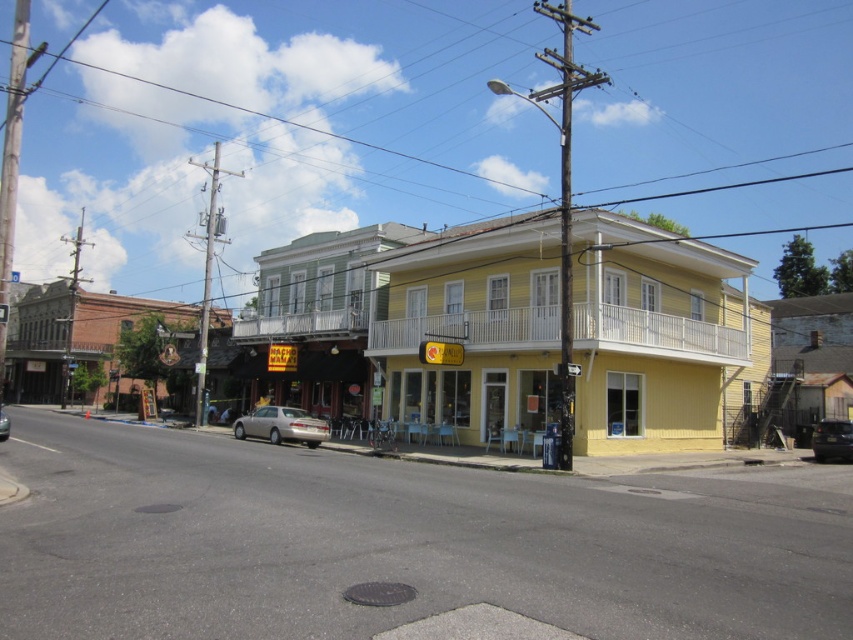
Who is taller, metallic gray utility pole at left or gold metallic sedan at center?

metallic gray utility pole at left is taller.

Can you confirm if metallic gray utility pole at left is bigger than gold metallic sedan at center?

Indeed, metallic gray utility pole at left has a larger size compared to gold metallic sedan at center.

Where is `metallic gray utility pole at left`? metallic gray utility pole at left is located at coordinates [x=206, y=275].

Who is shorter, brushed metal pole at left or matte silver sedan at center?

matte silver sedan at center is shorter.

This screenshot has width=853, height=640. I want to click on brushed metal pole at left, so click(12, 144).

Can you confirm if metallic gray utility pole at left is smaller than metallic silver car at lower right?

Incorrect, metallic gray utility pole at left is not smaller in size than metallic silver car at lower right.

Is metallic gray utility pole at left further to camera compared to metallic silver car at lower right?

Yes, it is.

Does point (190, 164) come farther from viewer compared to point (845, 435)?

Yes.

Where is `metallic gray utility pole at left`? The width and height of the screenshot is (853, 640). metallic gray utility pole at left is located at coordinates (206, 275).